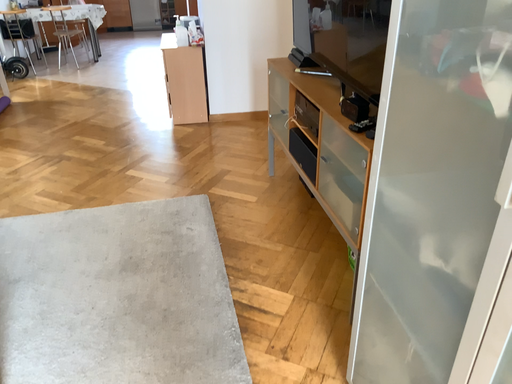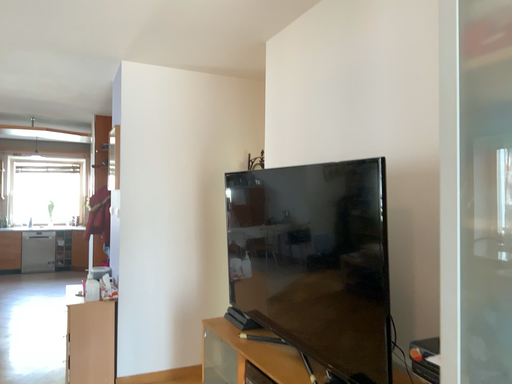
Question: How did the camera likely rotate when shooting the video?

Choices:
 (A) rotated right
 (B) rotated left

Answer: (A)